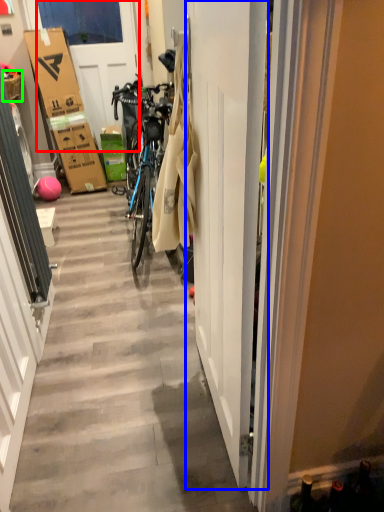
Question: Which is farther away from door (highlighted by a red box)? door (highlighted by a blue box) or picnic basket (highlighted by a green box)?

Choices:
 (A) door
 (B) picnic basket

Answer: (A)